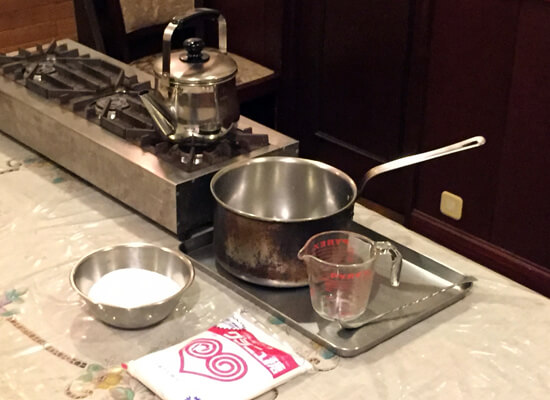
You are a GUI agent. You are given a task and a screenshot of the screen. Output one action in this format:
    pyautogui.click(x=<x>, y=<y>)
    Task: Click on the outlet
    
    Given the screenshot: What is the action you would take?
    pyautogui.click(x=445, y=205)